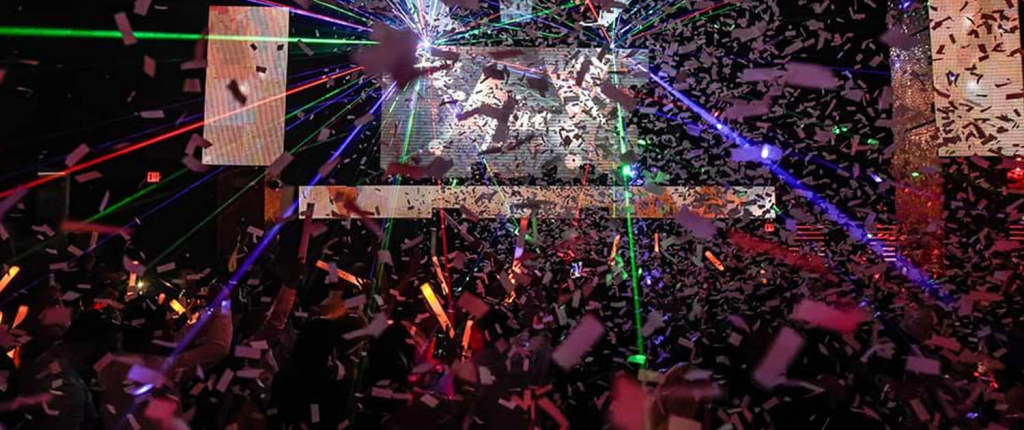
Where is `door`? The image size is (1024, 430). door is located at coordinates pyautogui.click(x=53, y=195).